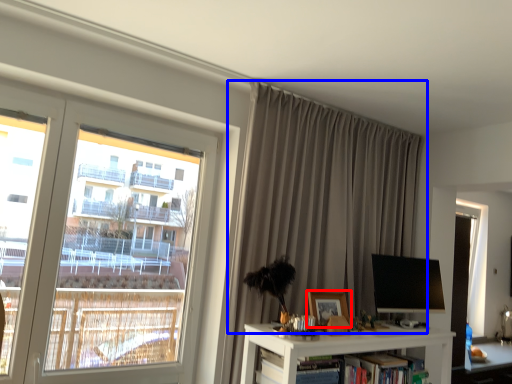
Question: Which of the following is the farthest to the observer, picture frame (highlighted by a red box) or curtain (highlighted by a blue box)?

Choices:
 (A) picture frame
 (B) curtain

Answer: (A)